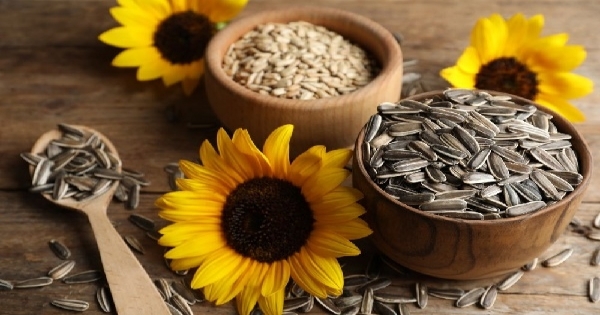
You are a GUI agent. You are given a task and a screenshot of the screen. Output one action in this format:
    pyautogui.click(x=<x>, y=<y>)
    Task: Click on the wooden bowl
    This screenshot has width=600, height=315.
    Given the screenshot: What is the action you would take?
    pyautogui.click(x=333, y=120)